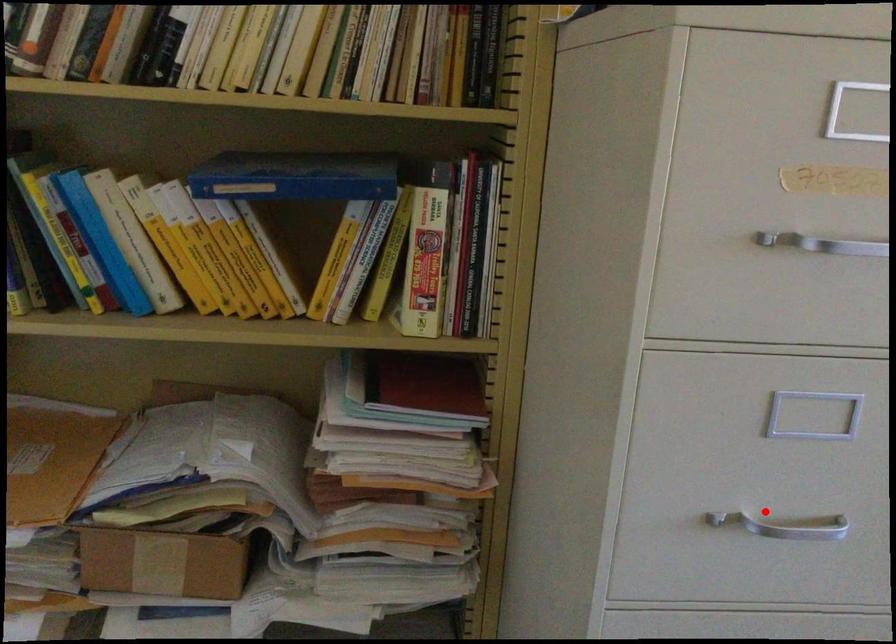
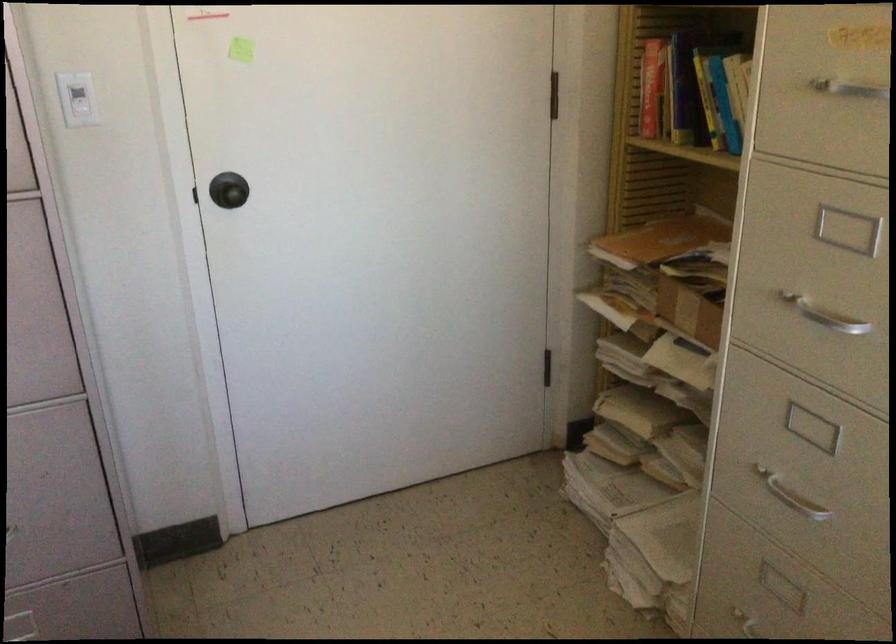
The point at the highlighted location is marked in the first image. Where is the corresponding point in the second image?

(824, 315)